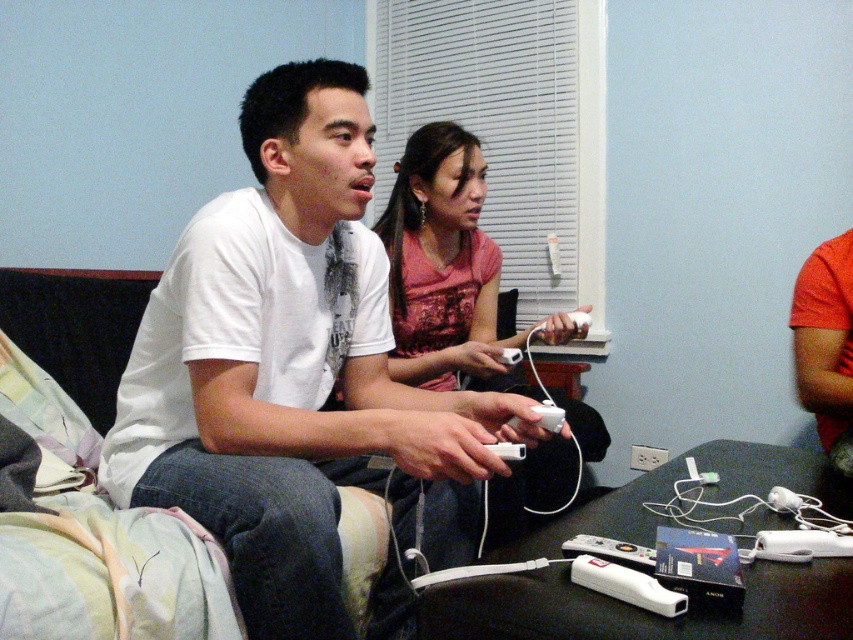
You are a photographer trying to capture a closeup of the matte pink shirt at center and the white plastic remote at center. Which object should you focus on first to ensure it appears sharp in the photo?

The matte pink shirt at center is closer to the viewer than the white plastic remote at center, so you should focus on the matte pink shirt at center first to ensure it appears sharp.

You are designing a storage box for the white matte wii remote at lower center. The box must be slightly larger than the remote to accommodate it comfortably. Considering the size relationship between the matte pink shirt at center and the remote, can the box be designed using the same dimensions as the shirt?

The matte pink shirt at center is wider than the white matte wii remote at lower center. Therefore, designing the box with the shirt as a reference would result in a box that is too large for the remote, so it is not advisable to use the same dimensions.